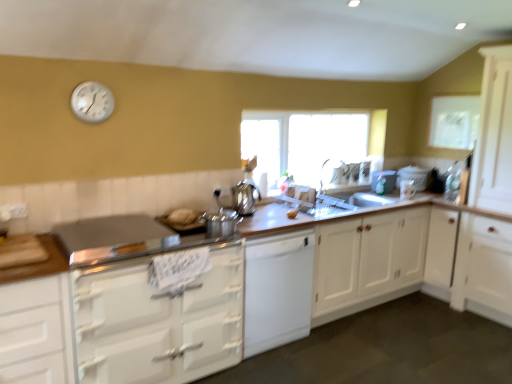
The image size is (512, 384). In order to click on vacant space to the left of yellow matte apple at center in this screenshot , I will do `click(271, 221)`.